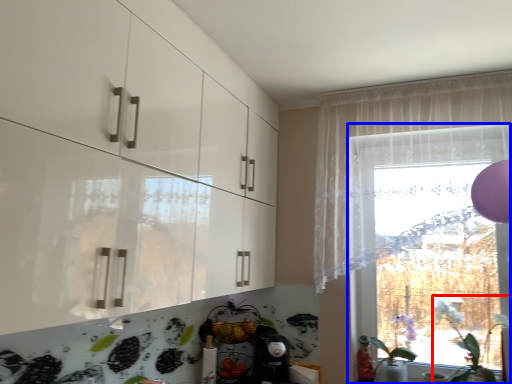
Question: Which object appears farthest to the camera in this image, plant (highlighted by a red box) or window (highlighted by a blue box)?

Choices:
 (A) plant
 (B) window

Answer: (B)